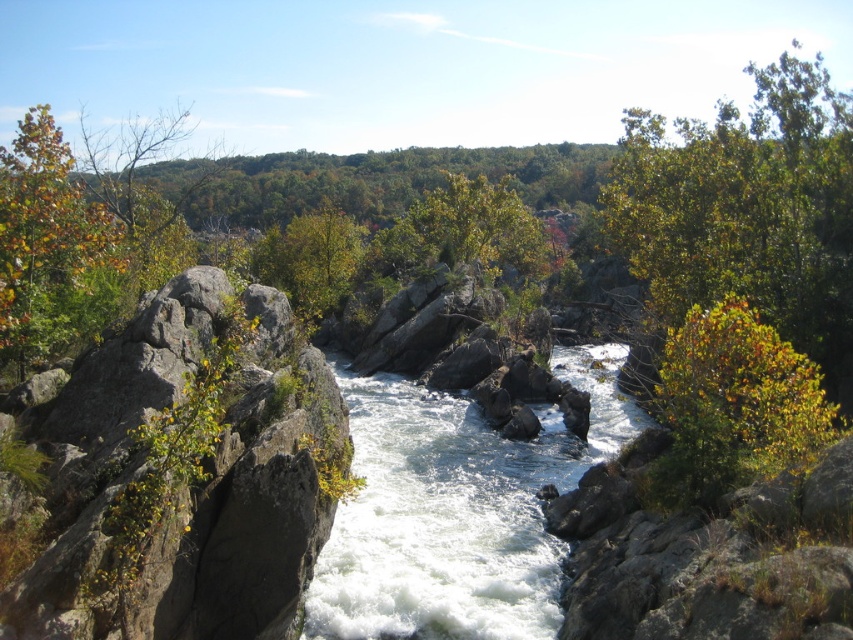
Looking at this image, how distant is gray rough rock at left from green leafy tree at center right?

gray rough rock at left and green leafy tree at center right are 37.18 feet apart.

Is gray rough rock at left wider than green leafy tree at center right?

Correct, the width of gray rough rock at left exceeds that of green leafy tree at center right.

At what (x,y) coordinates should I click in order to perform the action: click on gray rough rock at left. Please return your answer as a coordinate pair (x, y). The width and height of the screenshot is (853, 640). Looking at the image, I should click on (184, 477).

Is white frothy water at center to the left of green matte tree at left from the viewer's perspective?

No, white frothy water at center is not to the left of green matte tree at left.

Between point (311, 621) and point (57, 253), which one is positioned in front?

Point (57, 253) is in front.

Locate an element on the screen. white frothy water at center is located at coordinates (456, 508).

Between gray rough rock at left and white frothy water at center, which one appears on the left side from the viewer's perspective?

gray rough rock at left

Between point (308, 560) and point (433, 632), which one is positioned in front?

Positioned in front is point (308, 560).

At what (x,y) coordinates should I click in order to perform the action: click on gray rough rock at left. Please return your answer as a coordinate pair (x, y). The height and width of the screenshot is (640, 853). Looking at the image, I should click on (184, 477).